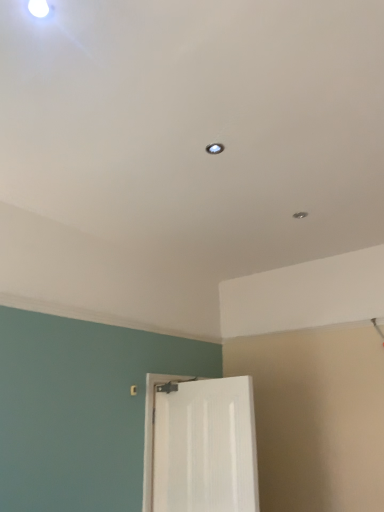
Question: Should I look upward or downward to see white glossy door at lower center?

Choices:
 (A) down
 (B) up

Answer: (A)